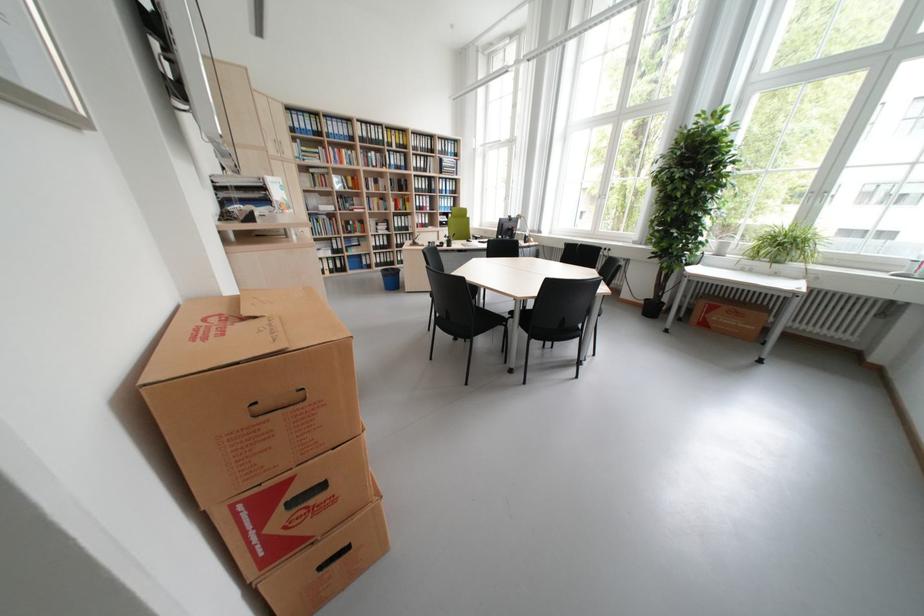
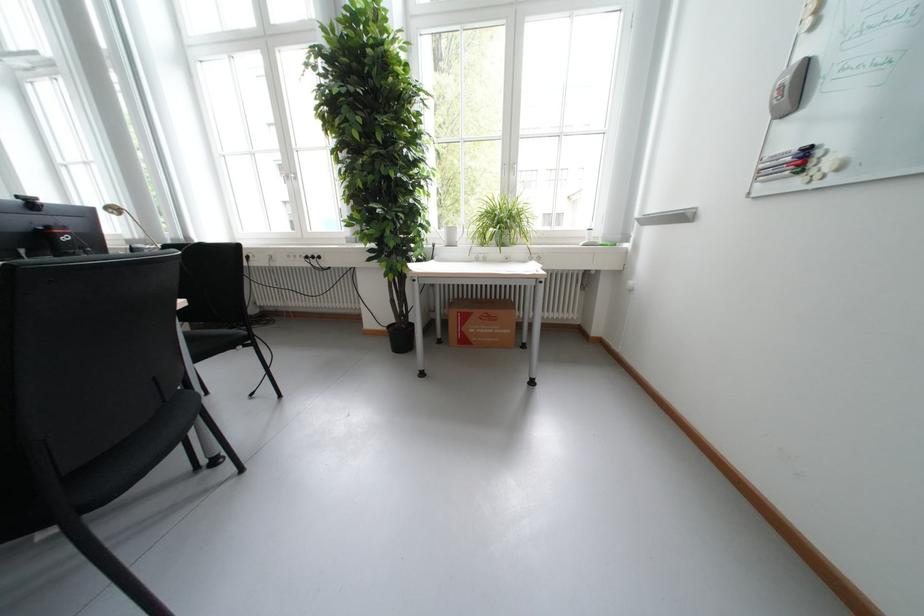
Find the pixel in the second image that matches (x=713, y=325) in the first image.

(475, 342)